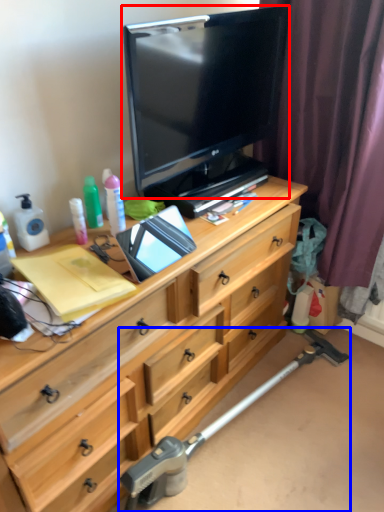
Question: Which object appears farthest to the camera in this image, television (highlighted by a red box) or crutch (highlighted by a blue box)?

Choices:
 (A) television
 (B) crutch

Answer: (B)